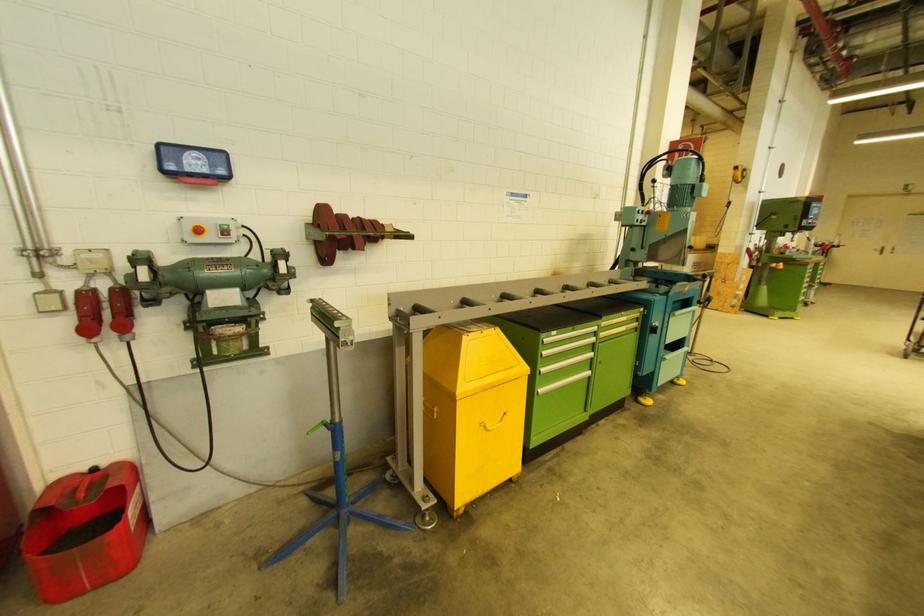
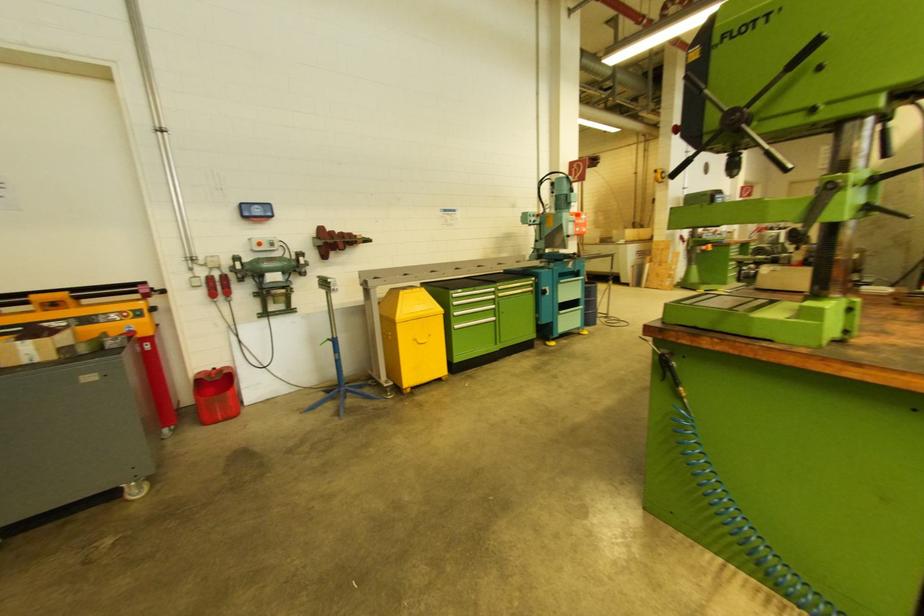
In the second image, find the point that corresponds to pixel 90 296 in the first image.

(212, 281)